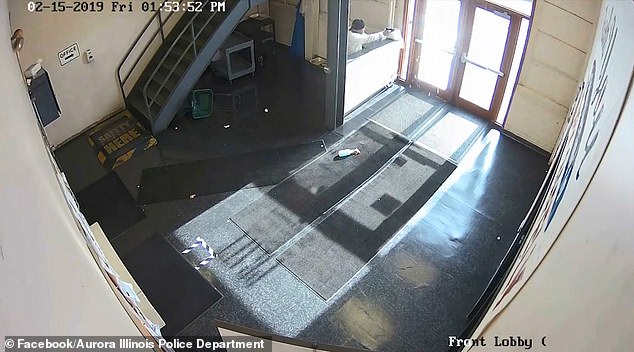
The width and height of the screenshot is (634, 352). In order to click on door handle in this screenshot , I will do `click(463, 55)`.